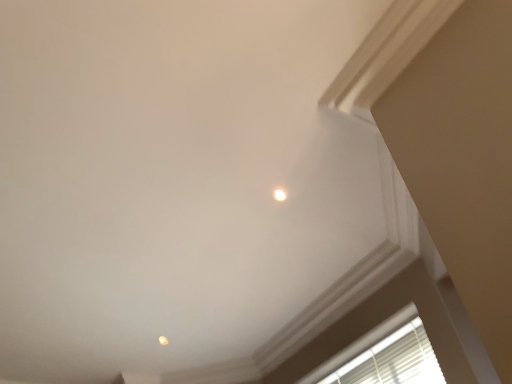
Question: Is matte orange light at upper center, acting as the 2th dot starting from the front, taller or shorter than white glossy light fixture at upper center, which appears as the first dot when viewed from the front?

Choices:
 (A) tall
 (B) short

Answer: (A)

Question: Does point (159, 339) appear closer or farther from the camera than point (280, 192)?

Choices:
 (A) farther
 (B) closer

Answer: (A)

Question: Which of these objects is positioned farthest from the matte orange light at upper center, marked as the 1th dot in a left-to-right arrangement?

Choices:
 (A) white blinds at lower right
 (B) white glossy light fixture at upper center, which is counted as the 1th dot, starting from the top

Answer: (B)

Question: Estimate the real-world distances between objects in this image. Which object is closer to the white glossy light fixture at upper center, the 2th dot viewed from the back?

Choices:
 (A) matte orange light at upper center, acting as the 2th dot starting from the front
 (B) white blinds at lower right

Answer: (B)